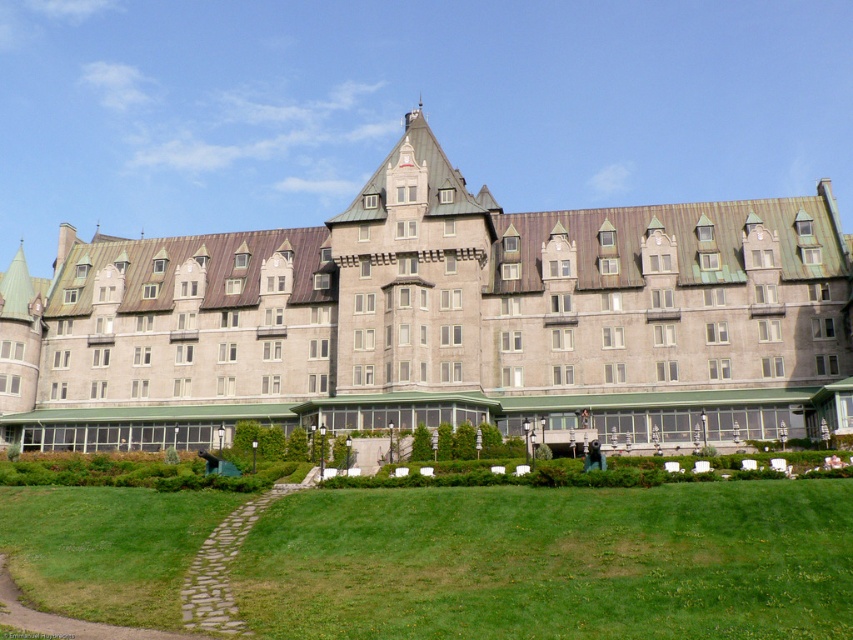
Is point (552, 301) positioned in front of point (689, 552)?

No, (552, 301) is further to viewer.

The image size is (853, 640). Find the location of `gray stone building at center`. gray stone building at center is located at coordinates (434, 321).

The image size is (853, 640). I want to click on gray stone building at center, so click(434, 321).